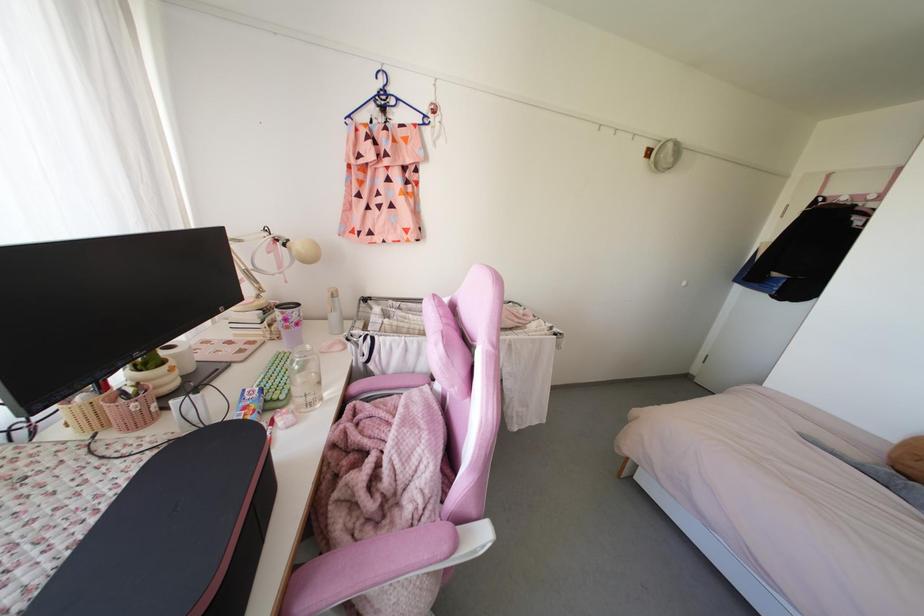
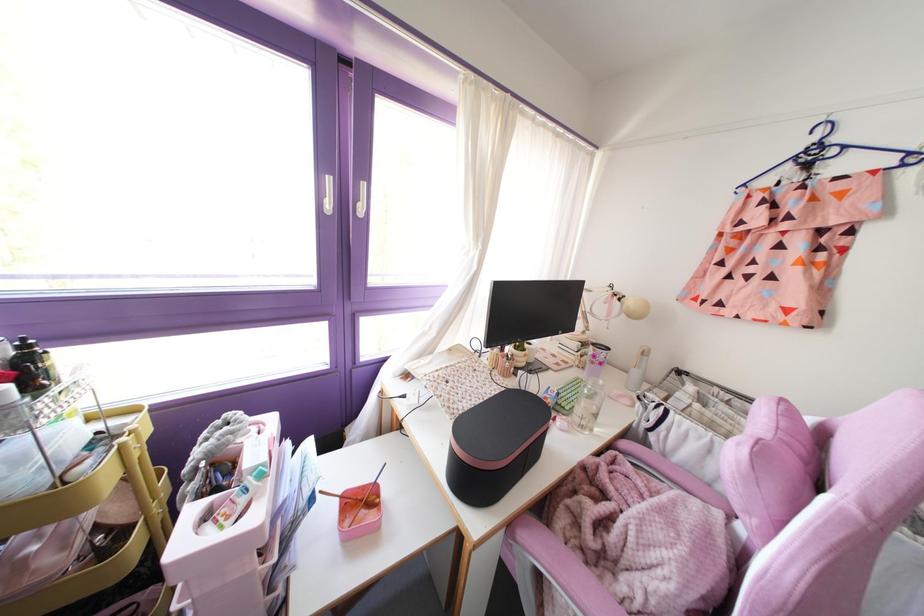
Locate, in the second image, the point that corresponds to point (430, 384) in the first image.

(727, 517)